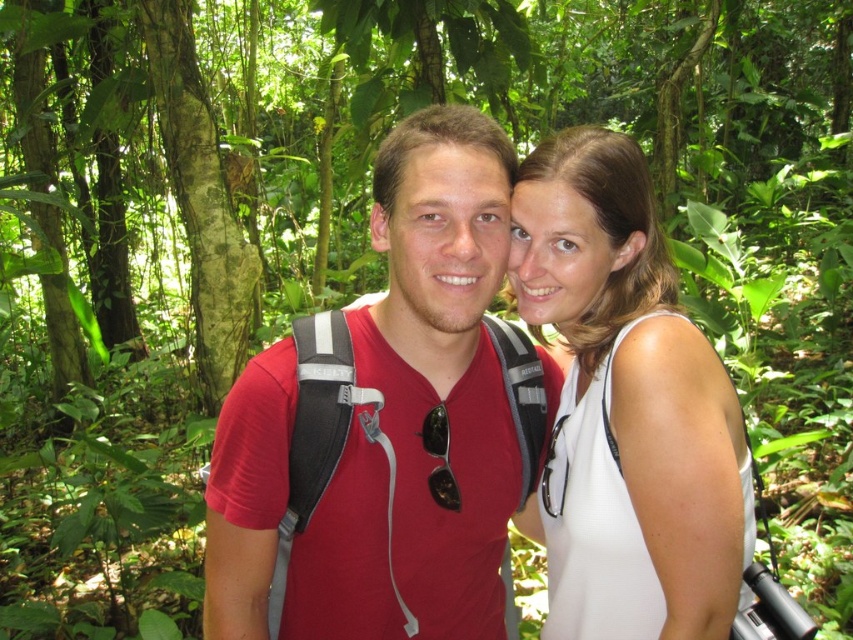
Which of these two, matte red shirt at center or white matte tank top at center, stands shorter?

Standing shorter between the two is matte red shirt at center.

Can you confirm if matte red shirt at center is positioned to the left of white matte tank top at center?

Indeed, matte red shirt at center is positioned on the left side of white matte tank top at center.

The height and width of the screenshot is (640, 853). Find the location of `matte red shirt at center`. matte red shirt at center is located at coordinates (392, 422).